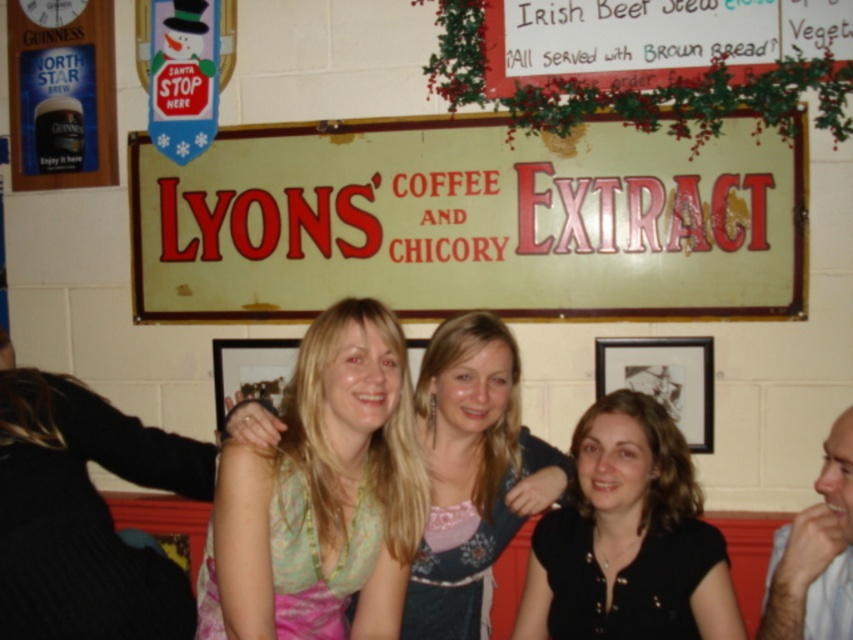
You are a customer in the cafe and want to read both the white paper sign at upper center and the pastel floral dress at center. Which one do you need to look further to see its full content?

The white paper sign at upper center is wider than the pastel floral dress at center, so you need to look further to see the full content of the white paper sign at upper center.

You are a customer in the cafe and want to order the Irish Beef Stew. The server points to the menu and mentions the vegetarian option. You notice two people at the center of the image, one with blonde hair and another wearing a matte blue dress. How far apart are the blonde hair at center and the matte blue dress at center?

The blonde hair at center is 26.65 inches from matte blue dress at center.

You are standing at the entrance of the cafe and want to take a photo of the main sign. The camera you are using has a minimum focus distance of 5 feet. Will the point at coordinates point [236,468] be in focus?

The distance of point [236,468] from the camera is 5.53 feet, which is greater than the minimum focus distance of 5 feet. Therefore, the point will be in focus.